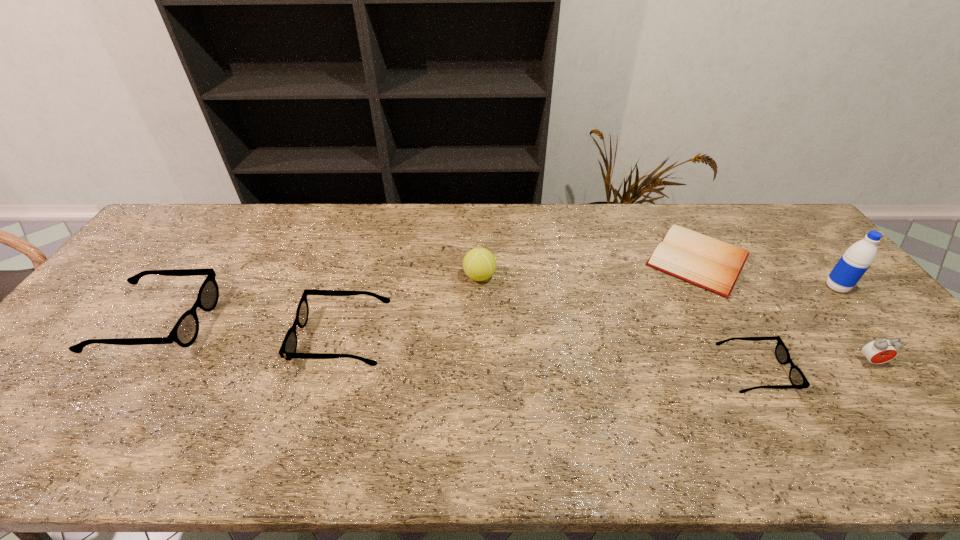
To make them evenly spaced by inserting another spectacles among them, please locate a vacant spot for this new spectacles. Please provide its 2D coordinates. Your answer should be formatted as a tuple, i.e. [(x, y)], where the tuple contains the x and y coordinates of a point satisfying the conditions above.

[(541, 354)]